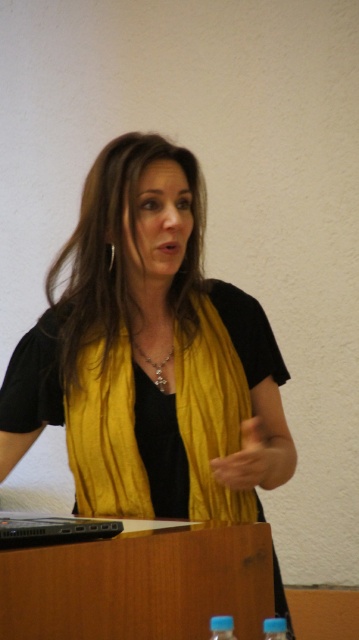
Does yellow silk scarf at center have a larger size compared to blue plastic bottle at lower center?

Correct, yellow silk scarf at center is larger in size than blue plastic bottle at lower center.

Does yellow silk scarf at center come in front of blue plastic bottle at lower center?

No.

Is point (192, 460) less distant than point (218, 621)?

No, (192, 460) is behind (218, 621).

Where is `yellow silk scarf at center`? Image resolution: width=359 pixels, height=640 pixels. yellow silk scarf at center is located at coordinates (143, 349).

What do you see at coordinates (221, 627) in the screenshot? I see `blue plastic bottle at lower center` at bounding box center [221, 627].

The height and width of the screenshot is (640, 359). In order to click on blue plastic bottle at lower center in this screenshot , I will do `click(221, 627)`.

At what (x,y) coordinates should I click in order to perform the action: click on blue plastic bottle at lower center. Please return your answer as a coordinate pair (x, y). The image size is (359, 640). Looking at the image, I should click on (221, 627).

This screenshot has width=359, height=640. Identify the location of blue plastic bottle at lower center. (221, 627).

Does black plastic laptop at lower left have a larger size compared to silver/glass necklace at center?

Correct, black plastic laptop at lower left is larger in size than silver/glass necklace at center.

Between black plastic laptop at lower left and silver/glass necklace at center, which one is positioned lower?

black plastic laptop at lower left

Identify the location of black plastic laptop at lower left. (53, 531).